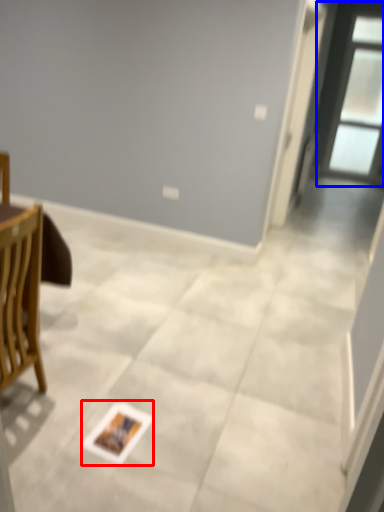
Question: Which object appears farthest to the camera in this image, postcard (highlighted by a red box) or window (highlighted by a blue box)?

Choices:
 (A) postcard
 (B) window

Answer: (B)